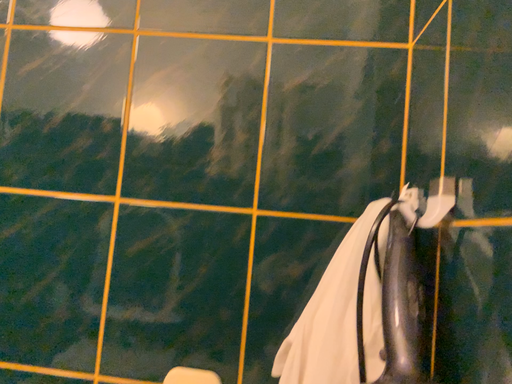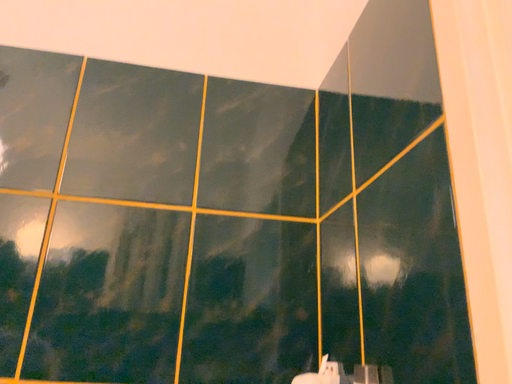
Question: How did the camera likely rotate when shooting the video?

Choices:
 (A) rotated downward
 (B) rotated upward

Answer: (B)